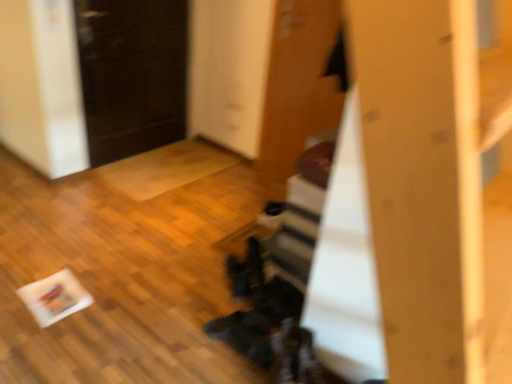
Locate an element on the screen. This screenshot has width=512, height=384. free space to the left of wooden door at upper center, which is the 2th door from left to right is located at coordinates (243, 187).